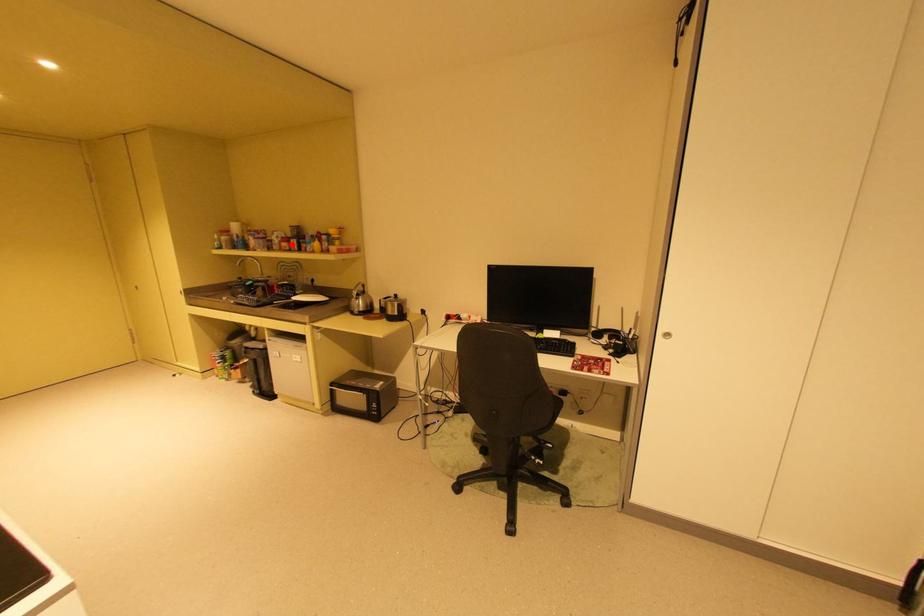
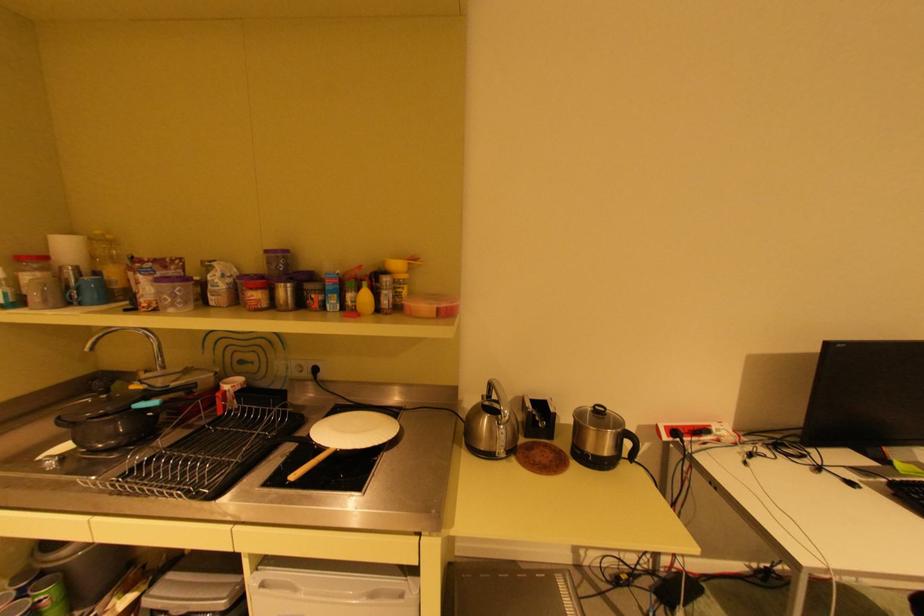
The point at the highlighted location is marked in the first image. Where is the corresponding point in the second image?

(264, 294)